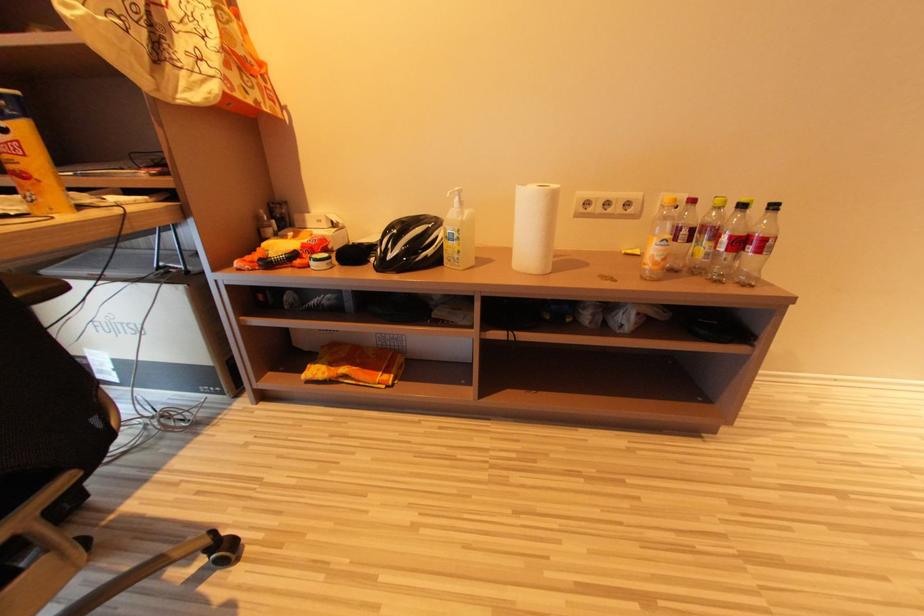
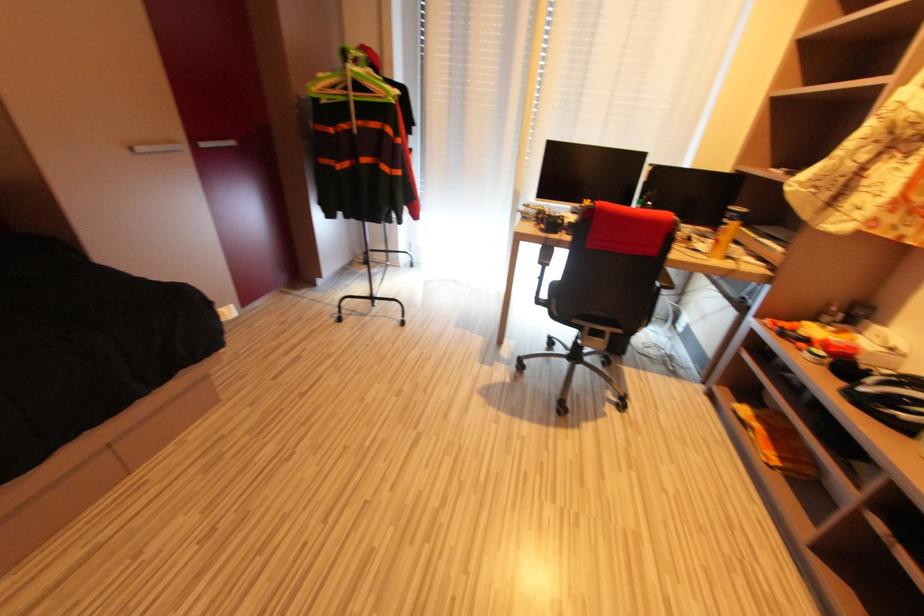
How did the camera likely rotate?

The camera's rotation is toward left-down.